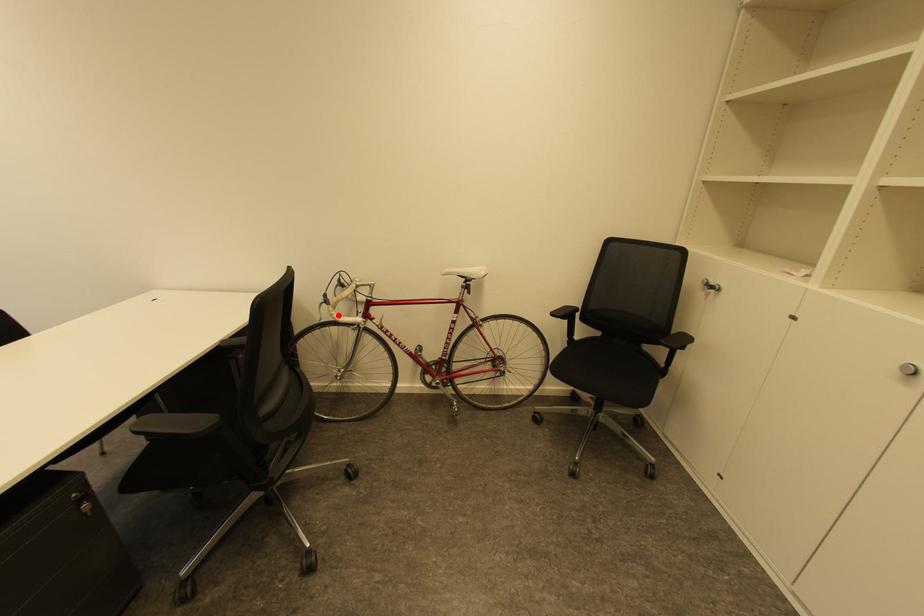
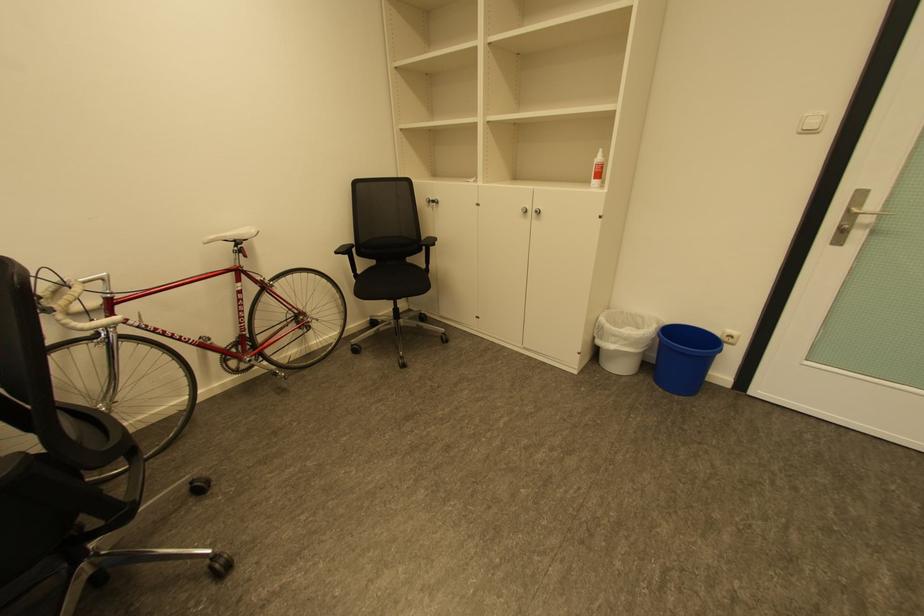
In the second image, find the point that corresponds to the highlighted location in the first image.

(70, 326)